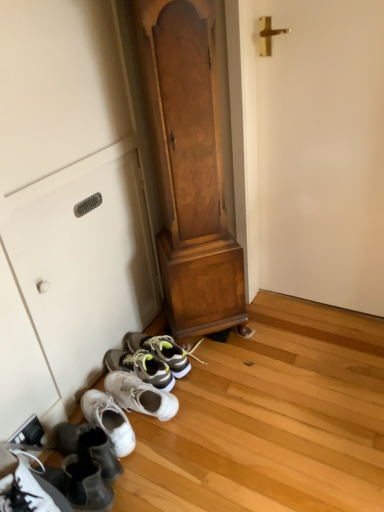
Question: Is white matte door at right far away from wooden dresser at center?

Choices:
 (A) yes
 (B) no

Answer: (B)

Question: Can you confirm if white matte door at right is taller than wooden dresser at center?

Choices:
 (A) no
 (B) yes

Answer: (A)

Question: Does white matte door at right have a lesser height compared to wooden dresser at center?

Choices:
 (A) yes
 (B) no

Answer: (A)

Question: Does white matte door at right turn towards wooden dresser at center?

Choices:
 (A) no
 (B) yes

Answer: (A)

Question: From a real-world perspective, is white matte door at right on top of wooden dresser at center?

Choices:
 (A) yes
 (B) no

Answer: (B)

Question: Would you say white matte cabinet at lower left is inside or outside wooden dresser at center?

Choices:
 (A) inside
 (B) outside

Answer: (B)

Question: Is point click(x=132, y=55) positioned closer to the camera than point click(x=157, y=113)?

Choices:
 (A) closer
 (B) farther

Answer: (B)

Question: In terms of size, does white matte cabinet at lower left appear bigger or smaller than wooden dresser at center?

Choices:
 (A) small
 (B) big

Answer: (A)

Question: From the image's perspective, relative to wooden dresser at center, is white matte cabinet at lower left above or below?

Choices:
 (A) above
 (B) below

Answer: (B)

Question: From the image's perspective, is white matte door at right above or below white matte cabinet at lower left?

Choices:
 (A) below
 (B) above

Answer: (B)

Question: Would you say white matte door at right is inside or outside white matte cabinet at lower left?

Choices:
 (A) outside
 (B) inside

Answer: (A)

Question: Is white matte door at right in front of or behind white matte cabinet at lower left in the image?

Choices:
 (A) front
 (B) behind

Answer: (A)

Question: In terms of size, does white matte door at right appear bigger or smaller than white matte cabinet at lower left?

Choices:
 (A) small
 (B) big

Answer: (B)

Question: Looking at the image, does white suede shoes at lower left seem bigger or smaller compared to white matte door at right?

Choices:
 (A) big
 (B) small

Answer: (B)

Question: From the image's perspective, is white suede shoes at lower left positioned above or below white matte door at right?

Choices:
 (A) above
 (B) below

Answer: (B)